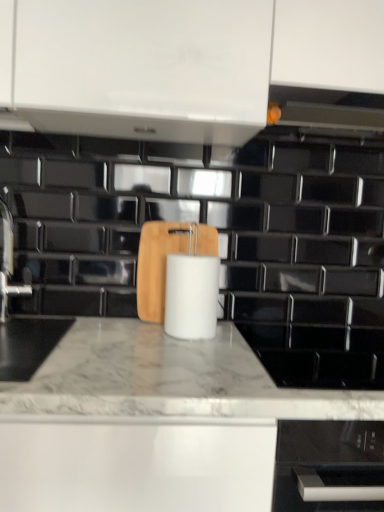
I want to click on free space on the front side of white matte paper towel at center, so click(x=189, y=352).